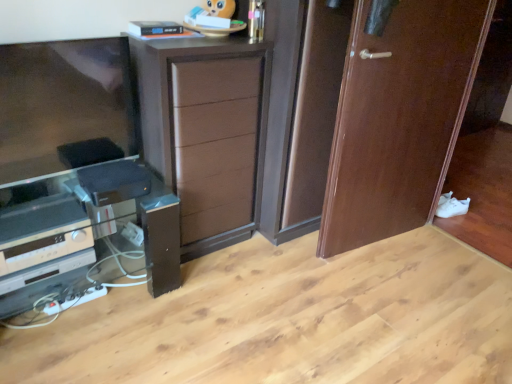
Question: From the image's perspective, would you say wooden door at right is shown under black glossy speaker at lower left?

Choices:
 (A) yes
 (B) no

Answer: (B)

Question: Is wooden door at right outside of black glossy speaker at lower left?

Choices:
 (A) yes
 (B) no

Answer: (A)

Question: Is wooden door at right positioned far away from black glossy speaker at lower left?

Choices:
 (A) no
 (B) yes

Answer: (B)

Question: Can you confirm if wooden door at right is positioned to the left of black glossy speaker at lower left?

Choices:
 (A) yes
 (B) no

Answer: (B)

Question: From a real-world perspective, is wooden door at right positioned under black glossy speaker at lower left based on gravity?

Choices:
 (A) yes
 (B) no

Answer: (B)

Question: From a real-world perspective, is wooden door at right over black glossy speaker at lower left?

Choices:
 (A) no
 (B) yes

Answer: (B)

Question: Considering the relative sizes of brown wood chest of drawers at center and wooden door at right in the image provided, is brown wood chest of drawers at center shorter than wooden door at right?

Choices:
 (A) no
 (B) yes

Answer: (B)

Question: From the image's perspective, is brown wood chest of drawers at center below wooden door at right?

Choices:
 (A) yes
 (B) no

Answer: (A)

Question: Considering the relative sizes of brown wood chest of drawers at center and wooden door at right in the image provided, is brown wood chest of drawers at center bigger than wooden door at right?

Choices:
 (A) no
 (B) yes

Answer: (B)

Question: Is brown wood chest of drawers at center closer to camera compared to wooden door at right?

Choices:
 (A) no
 (B) yes

Answer: (B)

Question: Could you tell me if brown wood chest of drawers at center is facing wooden door at right?

Choices:
 (A) yes
 (B) no

Answer: (B)

Question: From a real-world perspective, is brown wood chest of drawers at center under wooden door at right?

Choices:
 (A) no
 (B) yes

Answer: (B)

Question: Does white matte shoe at lower right have a smaller size compared to brown wood chest of drawers at center?

Choices:
 (A) yes
 (B) no

Answer: (A)